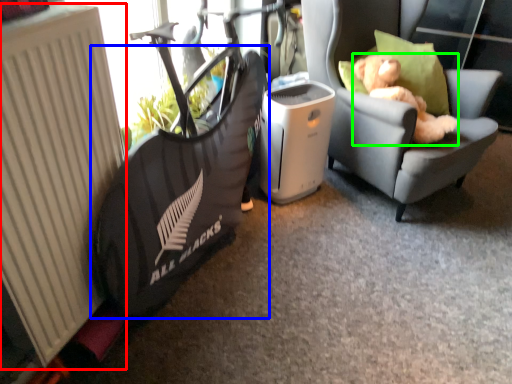
Question: Which object is positioned farthest from radiator (highlighted by a red box)? Select from bean bag chair (highlighted by a blue box) and animal (highlighted by a green box).

Choices:
 (A) bean bag chair
 (B) animal

Answer: (B)